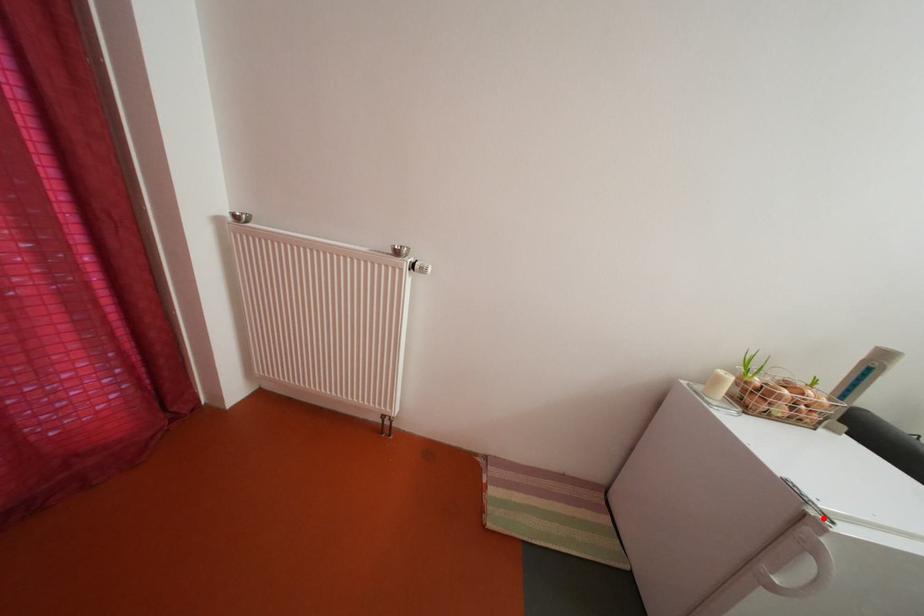
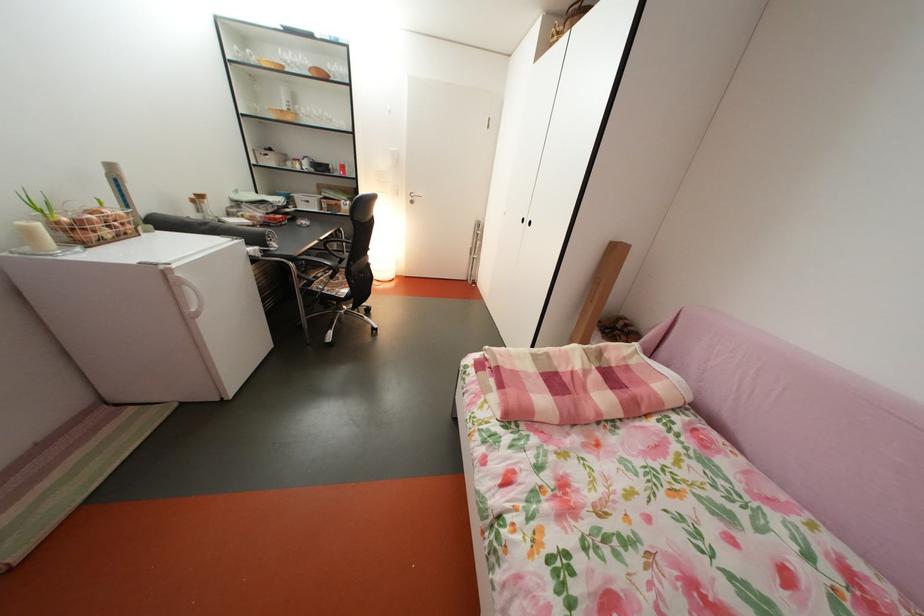
Find the pixel in the second image that matches the highlighted location in the first image.

(174, 274)